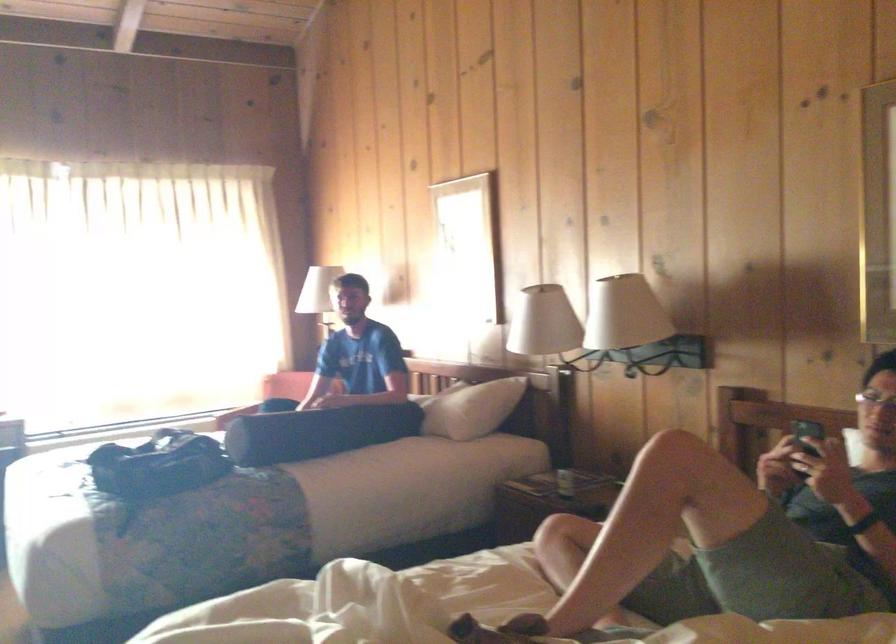
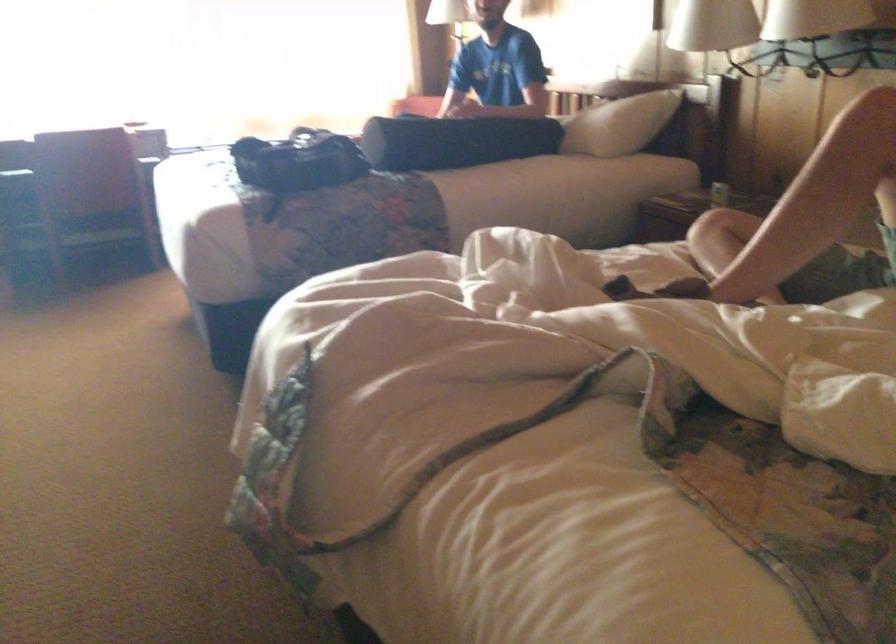
In the second image, find the point that corresponds to point 476,415 in the first image.

(618, 124)